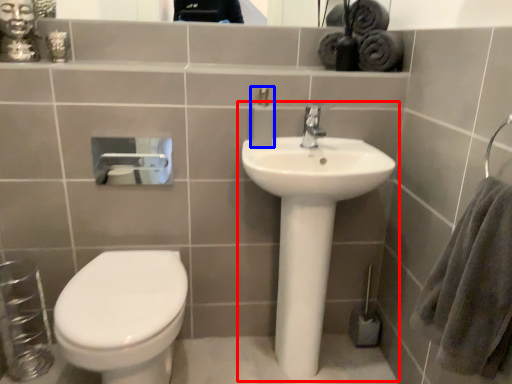
Question: Which of the following is the farthest to the observer, sink (highlighted by a red box) or soap dispenser (highlighted by a blue box)?

Choices:
 (A) sink
 (B) soap dispenser

Answer: (B)